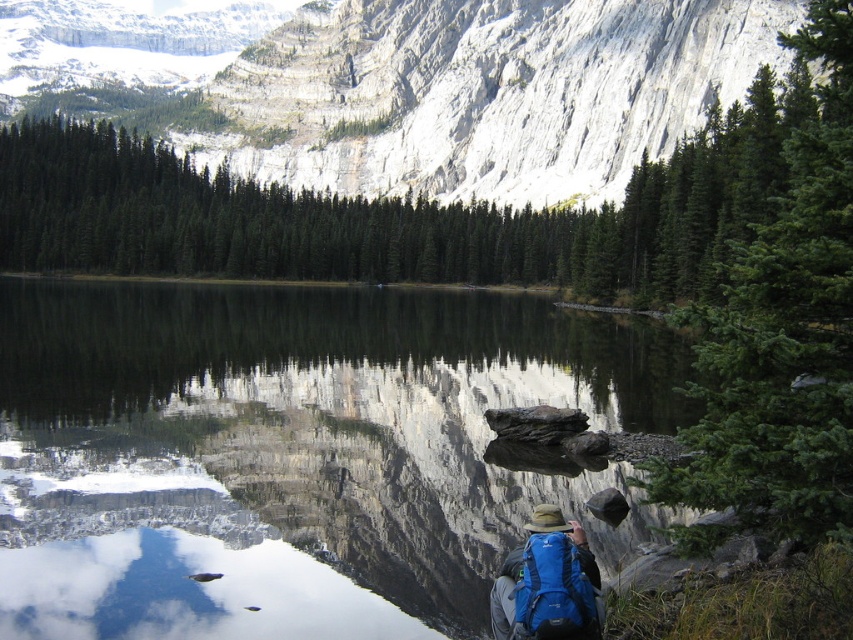
Is white rocky mountain at upper center positioned before blue fabric backpack at lower center?

No, it is not.

Is point (396, 88) positioned in front of point (578, 531)?

No, (396, 88) is further to viewer.

Is point (184, 83) positioned behind point (531, 588)?

Yes, point (184, 83) is behind point (531, 588).

The height and width of the screenshot is (640, 853). I want to click on white rocky mountain at upper center, so click(x=405, y=84).

At what (x,y) coordinates should I click in order to perform the action: click on smooth reflective water at center. Please return your answer as a coordinate pair (x, y). The image size is (853, 640). Looking at the image, I should click on (x=294, y=452).

Does smooth reflective water at center have a lesser width compared to blue fabric backpack at lower center?

No.

Which is in front, point (366, 518) or point (498, 605)?

Point (498, 605)

I want to click on smooth reflective water at center, so click(x=294, y=452).

Can you confirm if smooth reflective water at center is thinner than white rocky mountain at upper center?

Yes.

Does point (355, 595) lie in front of point (235, 104)?

That is True.

At what (x,y) coordinates should I click in order to perform the action: click on smooth reflective water at center. Please return your answer as a coordinate pair (x, y). Looking at the image, I should click on (294, 452).